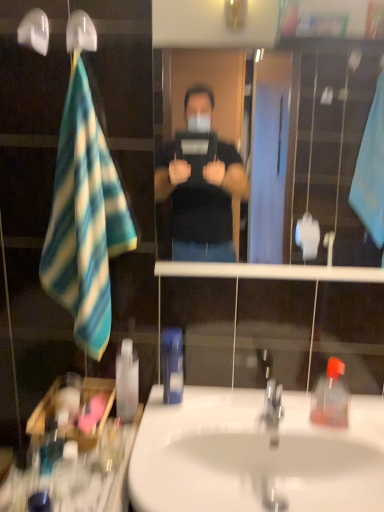
Question: From the image's perspective, is clear glass mirror at center beneath white glossy sink at center?

Choices:
 (A) no
 (B) yes

Answer: (A)

Question: Are clear glass mirror at center and white glossy sink at center located far from each other?

Choices:
 (A) no
 (B) yes

Answer: (B)

Question: Can you confirm if clear glass mirror at center is shorter than white glossy sink at center?

Choices:
 (A) yes
 (B) no

Answer: (B)

Question: Does clear glass mirror at center touch white glossy sink at center?

Choices:
 (A) yes
 (B) no

Answer: (B)

Question: Can you confirm if clear glass mirror at center is thinner than white glossy sink at center?

Choices:
 (A) yes
 (B) no

Answer: (A)

Question: Is white glossy sink at center at the back of clear glass mirror at center?

Choices:
 (A) no
 (B) yes

Answer: (A)

Question: From a real-world perspective, is blue plastic mouthwash at center, the second mouthwash when ordered from front to back, positioned under blue and white striped towel at left based on gravity?

Choices:
 (A) no
 (B) yes

Answer: (B)

Question: Can you see blue plastic mouthwash at center, the second mouthwash when ordered from front to back, touching blue and white striped towel at left?

Choices:
 (A) yes
 (B) no

Answer: (B)

Question: Is blue plastic mouthwash at center, which appears as the second mouthwash when viewed from the back, wider than blue and white striped towel at left?

Choices:
 (A) no
 (B) yes

Answer: (A)

Question: Does blue plastic mouthwash at center, which appears as the second mouthwash when viewed from the back, come in front of blue and white striped towel at left?

Choices:
 (A) yes
 (B) no

Answer: (B)

Question: Considering the relative sizes of blue plastic mouthwash at center, marked as the first mouthwash in a right-to-left arrangement, and blue and white striped towel at left in the image provided, is blue plastic mouthwash at center, marked as the first mouthwash in a right-to-left arrangement, thinner than blue and white striped towel at left?

Choices:
 (A) no
 (B) yes

Answer: (B)

Question: Does blue plastic mouthwash at center, marked as the first mouthwash in a right-to-left arrangement, have a lesser height compared to blue and white striped towel at left?

Choices:
 (A) yes
 (B) no

Answer: (A)

Question: Is white plastic shower head at upper left not near translucent plastic soap dispenser at right?

Choices:
 (A) no
 (B) yes

Answer: (A)